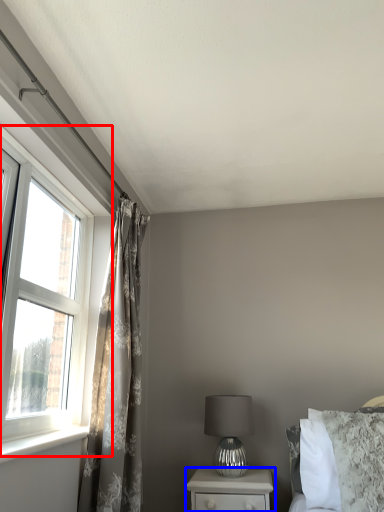
Question: Among these objects, which one is nearest to the camera, window (highlighted by a red box) or nightstand (highlighted by a blue box)?

Choices:
 (A) window
 (B) nightstand

Answer: (A)